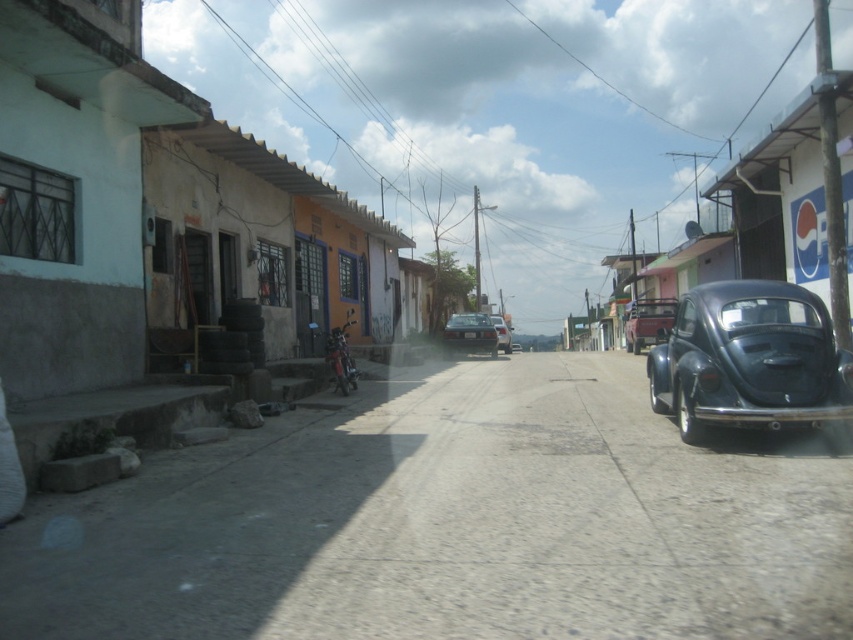
Question: Does metallic silver sedan at center have a greater width compared to shiny red motorcycle at center?

Choices:
 (A) yes
 (B) no

Answer: (A)

Question: Which of the following is the closest to the observer?

Choices:
 (A) (490, 353)
 (B) (625, 330)
 (C) (827, 419)
 (D) (326, 356)

Answer: (C)

Question: Which point is closer to the camera taking this photo?

Choices:
 (A) (332, 376)
 (B) (509, 333)

Answer: (A)

Question: Is glossy dark blue car at right in front of shiny red motorcycle at center?

Choices:
 (A) yes
 (B) no

Answer: (A)

Question: Which point is farther to the camera?

Choices:
 (A) click(x=697, y=349)
 (B) click(x=497, y=337)
 (C) click(x=349, y=385)

Answer: (B)

Question: Does glossy dark blue car at right come behind shiny red motorcycle at center?

Choices:
 (A) yes
 (B) no

Answer: (B)